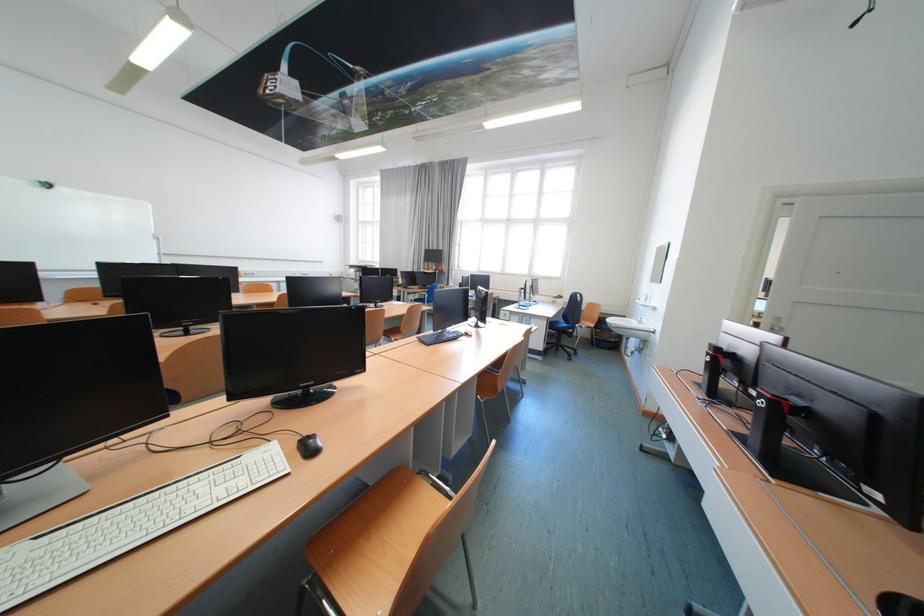
Where would you sit the wooden chair sitting surface? Please return your answer as a coordinate pair (x, y).

(375, 543)